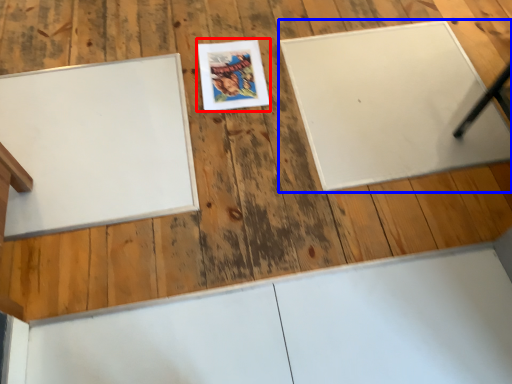
Question: Among these objects, which one is nearest to the camera, comic book (highlighted by a red box) or bulletin board (highlighted by a blue box)?

Choices:
 (A) comic book
 (B) bulletin board

Answer: (B)